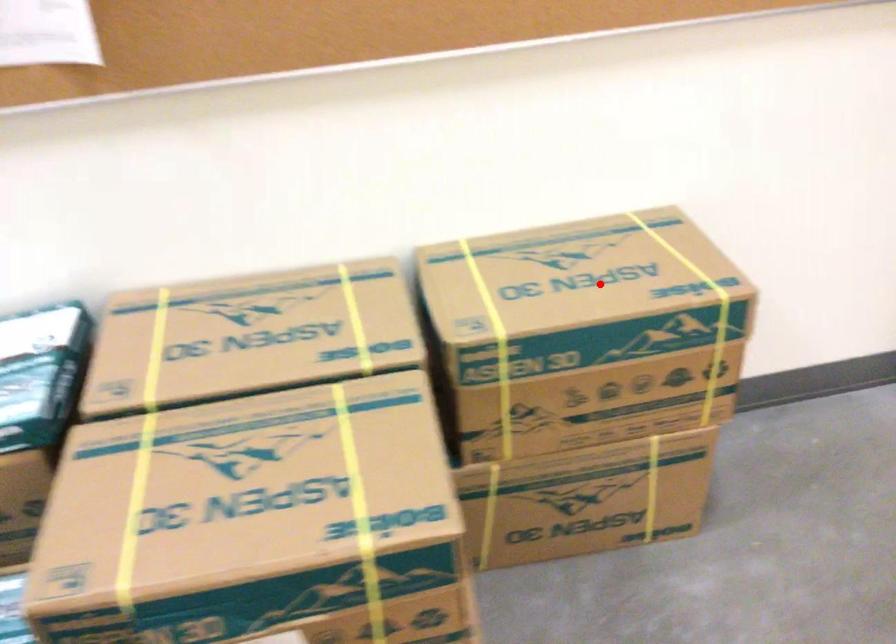
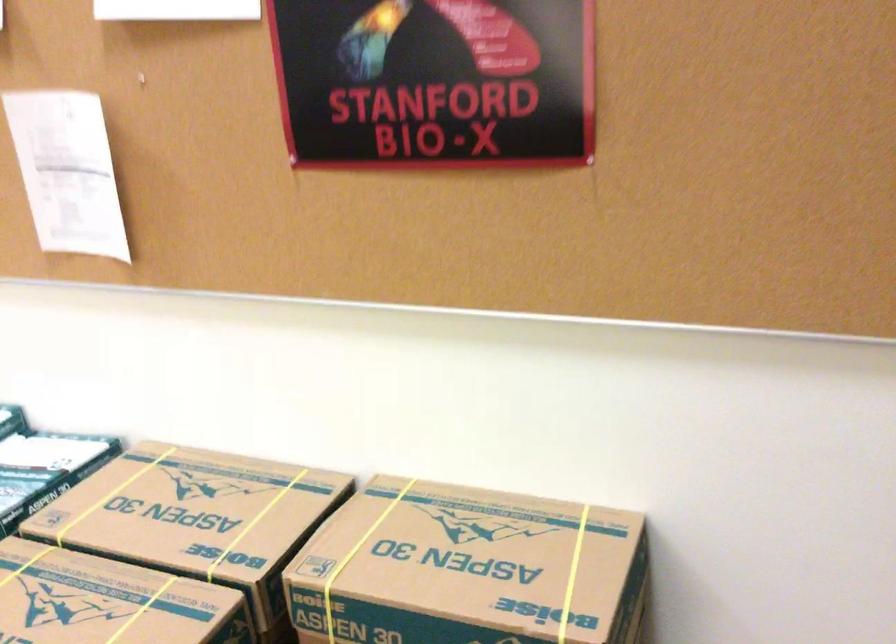
Find the pixel in the second image that matches the highlighted location in the first image.

(468, 569)